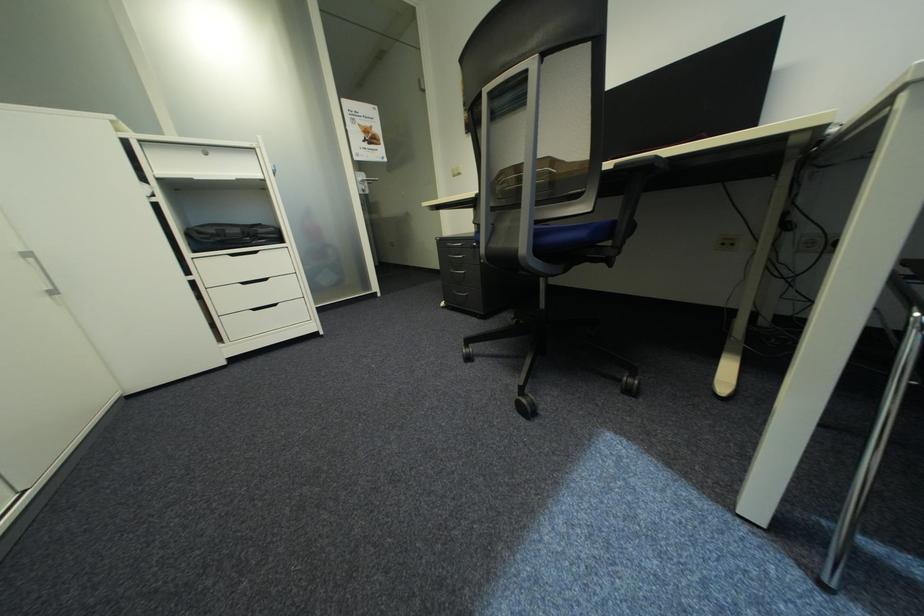
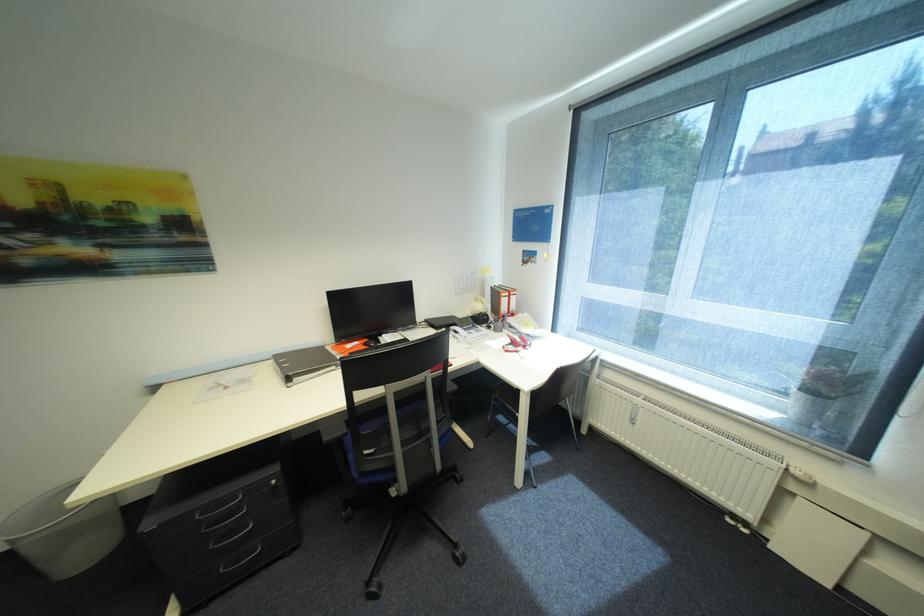
Locate, in the second image, the point that corresponds to point (460, 292) in the first image.

(229, 570)